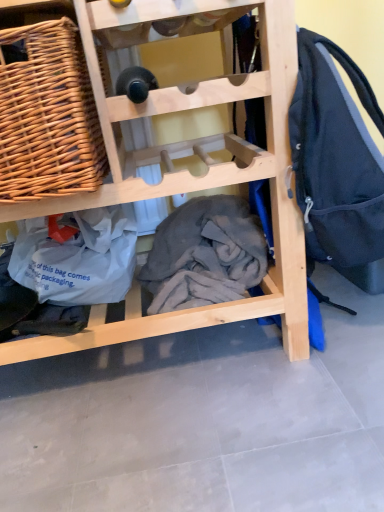
Question: Considering the relative positions of woven wood picnic basket at upper left and natural wood wine rack at center in the image provided, is woven wood picnic basket at upper left behind natural wood wine rack at center?

Choices:
 (A) yes
 (B) no

Answer: (A)

Question: From the image's perspective, is woven wood picnic basket at upper left beneath natural wood wine rack at center?

Choices:
 (A) no
 (B) yes

Answer: (A)

Question: Is woven wood picnic basket at upper left not within natural wood wine rack at center?

Choices:
 (A) no
 (B) yes

Answer: (A)

Question: Does woven wood picnic basket at upper left have a larger size compared to natural wood wine rack at center?

Choices:
 (A) no
 (B) yes

Answer: (A)

Question: Is woven wood picnic basket at upper left smaller than natural wood wine rack at center?

Choices:
 (A) no
 (B) yes

Answer: (B)

Question: From a real-world perspective, is natural wood wine rack at center positioned above or below gray cotton blanket at center?

Choices:
 (A) above
 (B) below

Answer: (A)

Question: Is point [x=87, y=329] positioned closer to the camera than point [x=221, y=294]?

Choices:
 (A) closer
 (B) farther

Answer: (A)

Question: From the image's perspective, relative to gray cotton blanket at center, is natural wood wine rack at center above or below?

Choices:
 (A) above
 (B) below

Answer: (A)

Question: Relative to gray cotton blanket at center, is natural wood wine rack at center in front or behind?

Choices:
 (A) behind
 (B) front

Answer: (B)

Question: Is natural wood wine rack at center taller or shorter than woven wood picnic basket at upper left?

Choices:
 (A) tall
 (B) short

Answer: (A)

Question: In terms of width, does natural wood wine rack at center look wider or thinner when compared to woven wood picnic basket at upper left?

Choices:
 (A) wide
 (B) thin

Answer: (A)

Question: From the image's perspective, is natural wood wine rack at center located above or below woven wood picnic basket at upper left?

Choices:
 (A) below
 (B) above

Answer: (A)

Question: Based on their positions, is natural wood wine rack at center located to the left or right of woven wood picnic basket at upper left?

Choices:
 (A) right
 (B) left

Answer: (A)

Question: Is gray cotton blanket at center bigger or smaller than woven wood picnic basket at upper left?

Choices:
 (A) small
 (B) big

Answer: (A)

Question: In the image, is gray cotton blanket at center on the left side or the right side of woven wood picnic basket at upper left?

Choices:
 (A) right
 (B) left

Answer: (A)